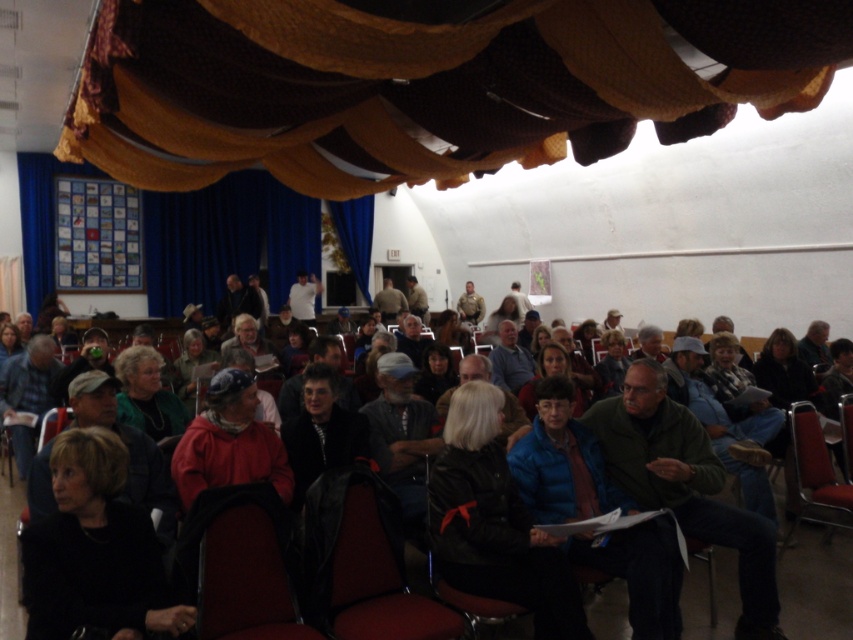
Question: Is black fabric jacket at lower left to the left of matte khaki uniform at center from the viewer's perspective?

Choices:
 (A) yes
 (B) no

Answer: (A)

Question: Among these objects, which one is farthest from the camera?

Choices:
 (A) black leather jacket at center
 (B) camouflage fabric jacket at center

Answer: (B)

Question: Which object appears closest to the camera in this image?

Choices:
 (A) camouflage fabric jacket at center
 (B) black fabric jacket at lower left

Answer: (B)

Question: Can you confirm if red fabric chair at center is thinner than camouflage fabric jacket at center?

Choices:
 (A) yes
 (B) no

Answer: (B)

Question: Which object appears farthest from the camera in this image?

Choices:
 (A) blue fabric jacket at center
 (B) blue plaid shirt at center
 (C) black leather jacket at center
 (D) green matte jacket at center

Answer: (B)

Question: Is blue fabric jacket at center positioned in front of matte khaki uniform at center?

Choices:
 (A) yes
 (B) no

Answer: (A)